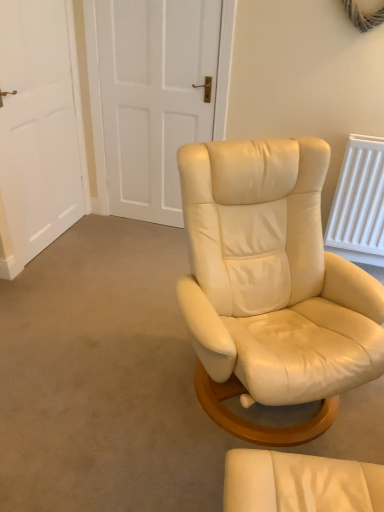
Locate an element on the screen. The width and height of the screenshot is (384, 512). vacant space to the left of white matte door at upper center, acting as the 2th door starting from the left is located at coordinates (109, 232).